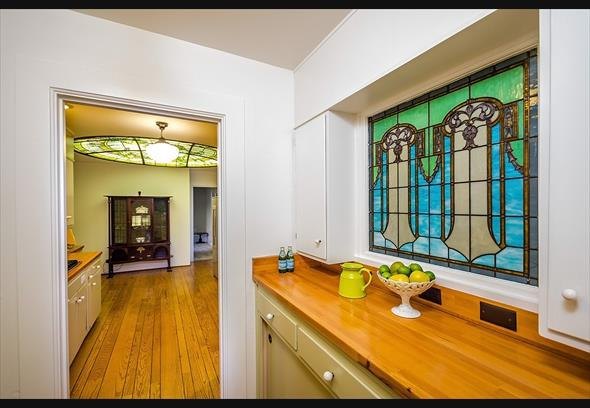
Identify the location of sink. (77, 266).